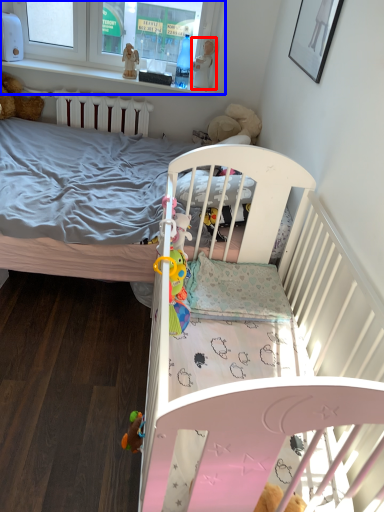
Question: Which object appears farthest to the camera in this image, toy (highlighted by a red box) or window frame (highlighted by a blue box)?

Choices:
 (A) toy
 (B) window frame

Answer: (A)